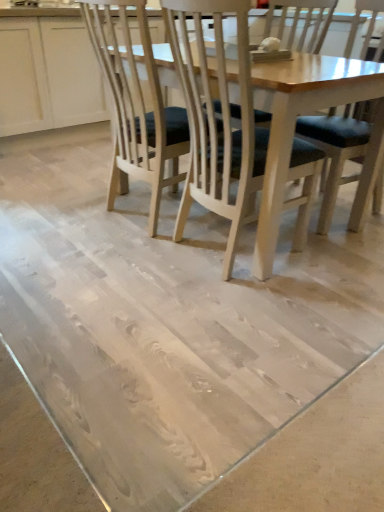
Question: Is wooden chair with dark cushion at center, which appears as the first chair when viewed from the left, taller than white wood cabinet at upper left?

Choices:
 (A) yes
 (B) no

Answer: (A)

Question: Can you confirm if wooden chair with dark cushion at center, which appears as the first chair when viewed from the left, is bigger than white wood cabinet at upper left?

Choices:
 (A) yes
 (B) no

Answer: (B)

Question: From the image's perspective, is wooden chair with dark cushion at center, the 2th chair when ordered from right to left, located beneath white wood cabinet at upper left?

Choices:
 (A) no
 (B) yes

Answer: (B)

Question: Is wooden chair with dark cushion at center, the 2th chair when ordered from right to left, smaller than white wood cabinet at upper left?

Choices:
 (A) no
 (B) yes

Answer: (B)

Question: Does wooden chair with dark cushion at center, the 2th chair when ordered from right to left, have a lesser width compared to white wood cabinet at upper left?

Choices:
 (A) yes
 (B) no

Answer: (A)

Question: From a real-world perspective, is wooden chair with dark cushion at center, which appears as the first chair when viewed from the left, on top of white wood cabinet at upper left?

Choices:
 (A) yes
 (B) no

Answer: (A)

Question: Are white wood cabinet at upper left and wooden chair with dark cushion at center, the 2th chair when ordered from right to left, located far from each other?

Choices:
 (A) no
 (B) yes

Answer: (B)

Question: Does white wood cabinet at upper left have a lesser width compared to wooden chair with dark cushion at center, which appears as the first chair when viewed from the left?

Choices:
 (A) yes
 (B) no

Answer: (B)

Question: Considering the relative positions of white wood cabinet at upper left and wooden chair with dark cushion at center, which appears as the first chair when viewed from the left, in the image provided, is white wood cabinet at upper left behind wooden chair with dark cushion at center, which appears as the first chair when viewed from the left,?

Choices:
 (A) no
 (B) yes

Answer: (B)

Question: From the image's perspective, is white wood cabinet at upper left on wooden chair with dark cushion at center, the 2th chair when ordered from right to left?

Choices:
 (A) yes
 (B) no

Answer: (A)

Question: Does white wood cabinet at upper left have a greater height compared to wooden chair with dark cushion at center, which appears as the first chair when viewed from the left?

Choices:
 (A) no
 (B) yes

Answer: (A)

Question: Is white wood cabinet at upper left touching wooden chair with dark cushion at center, the 2th chair when ordered from right to left?

Choices:
 (A) no
 (B) yes

Answer: (A)

Question: Considering the relative positions of dark blue fabric chair at center, placed as the second chair when sorted from left to right, and white wood cabinet at upper left in the image provided, is dark blue fabric chair at center, placed as the second chair when sorted from left to right, to the right of white wood cabinet at upper left from the viewer's perspective?

Choices:
 (A) no
 (B) yes

Answer: (B)